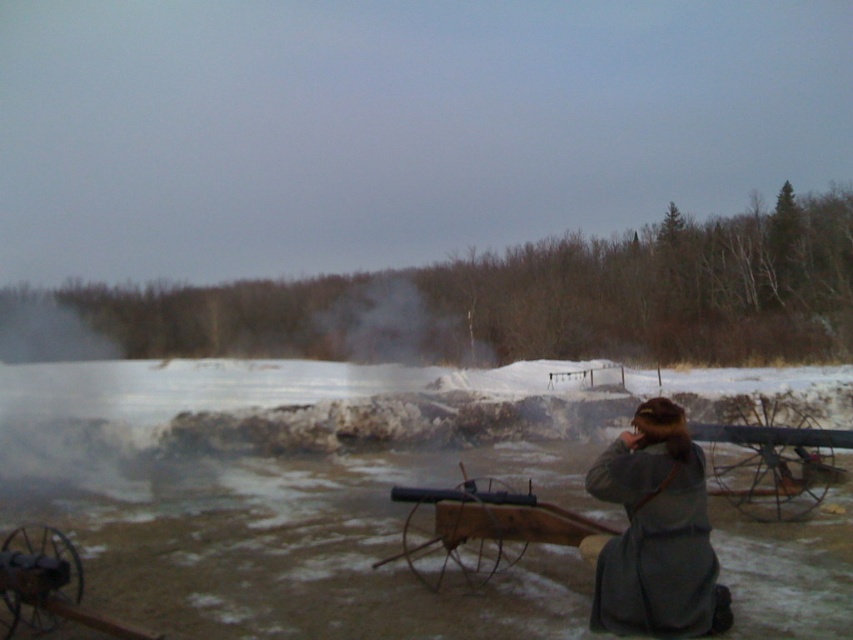
Question: Does gray wool coat at lower right appear on the right side of black matte cannon at lower left?

Choices:
 (A) yes
 (B) no

Answer: (A)

Question: Which point is farther to the camera?

Choices:
 (A) (637, 416)
 (B) (45, 602)

Answer: (A)

Question: Is gray wool coat at lower right smaller than black matte cannon at lower left?

Choices:
 (A) yes
 (B) no

Answer: (B)

Question: Considering the relative positions of gray wool coat at lower right and black matte cannon at lower left in the image provided, where is gray wool coat at lower right located with respect to black matte cannon at lower left?

Choices:
 (A) right
 (B) left

Answer: (A)

Question: Among these objects, which one is nearest to the camera?

Choices:
 (A) gray wool coat at lower right
 (B) black matte cannon at lower left

Answer: (B)

Question: Which object is closer to the camera taking this photo?

Choices:
 (A) black matte cannon at lower left
 (B) gray wool coat at lower right

Answer: (A)